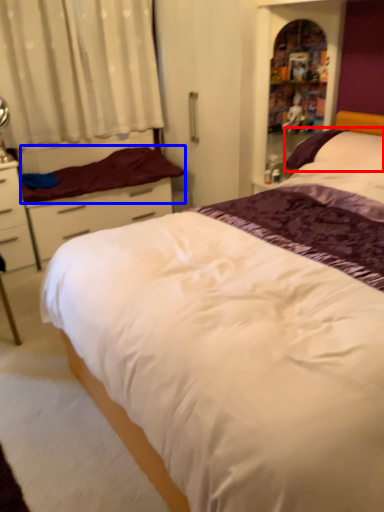
Question: Which point is closer to the camera, pillow (highlighted by a red box) or mattress (highlighted by a blue box)?

Choices:
 (A) pillow
 (B) mattress

Answer: (A)